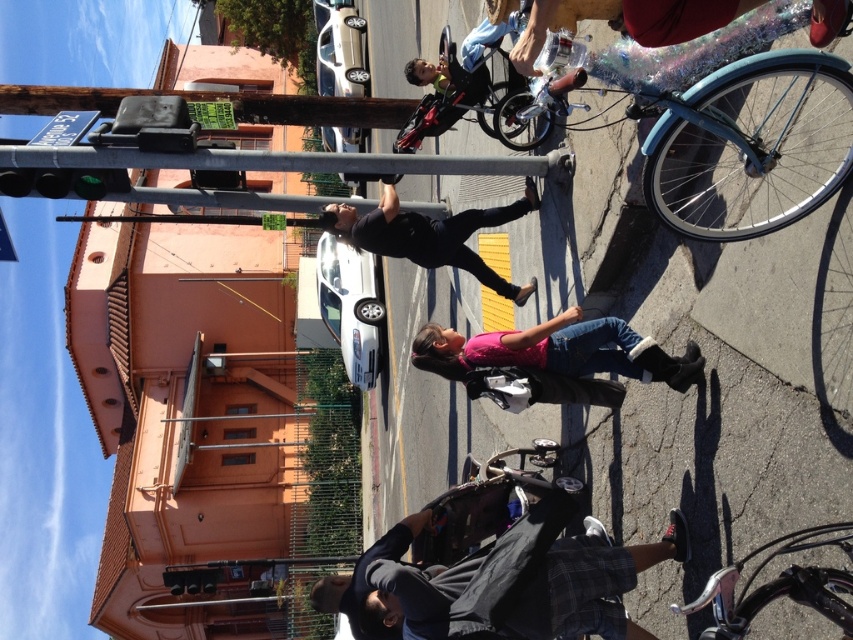
You are a photographer standing in the street scene. You want to take a photo of both shiny metallic bicycle at center and shiny metallic bicycle at lower right. Which bicycle should you focus on first if you want to capture the taller one?

The shiny metallic bicycle at center is taller than the shiny metallic bicycle at lower right, so you should focus on the shiny metallic bicycle at center first to capture the taller one.

You are a delivery person trying to reach the shiny metallic bicycle at center to pick up a package. However, there is another shiny metallic bicycle at lower right blocking your path. Can you easily access the bicycle you need?

The shiny metallic bicycle at lower right is behind the shiny metallic bicycle at center, so you can easily access the shiny metallic bicycle at center without obstruction.

You are a delivery person who needs to choose between two bicycles to carry a large package. The shiny blue bicycle at right and the shiny metallic bicycle at lower right are available. Which bicycle would be more suitable for carrying a large package based on their widths?

The shiny metallic bicycle at lower right has a greater width compared to the shiny blue bicycle at right, making it more suitable for carrying a large package since it can accommodate wider loads.